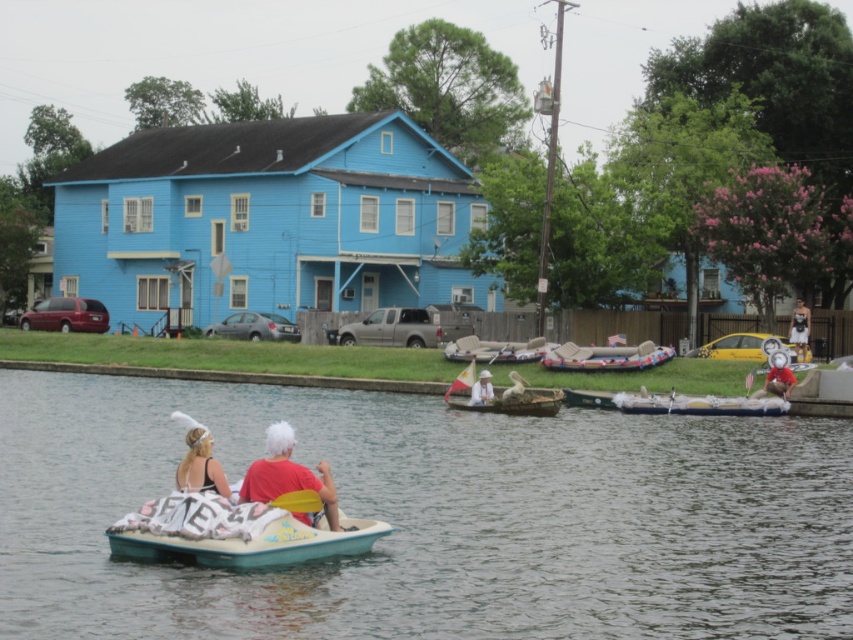
Question: Which object appears farthest from the camera in this image?

Choices:
 (A) red and white striped float at center
 (B) teal plastic paddle boat at center
 (C) white fabric at center
 (D) matte black swimsuit at lower left

Answer: (A)

Question: From the image, what is the correct spatial relationship of white fluffy boat at center in relation to matte black swimsuit at lower left?

Choices:
 (A) below
 (B) above

Answer: (A)

Question: Which of the following is the closest to the observer?

Choices:
 (A) (671, 403)
 (B) (196, 486)

Answer: (B)

Question: Is blue plastic boat at center closer to camera compared to white fluffy boat at center?

Choices:
 (A) no
 (B) yes

Answer: (B)

Question: Is blue plastic boat at center wider than wooden canoe at center?

Choices:
 (A) no
 (B) yes

Answer: (B)

Question: Which of the following is the closest to the observer?

Choices:
 (A) (537, 404)
 (B) (648, 355)
 (C) (699, 401)

Answer: (A)